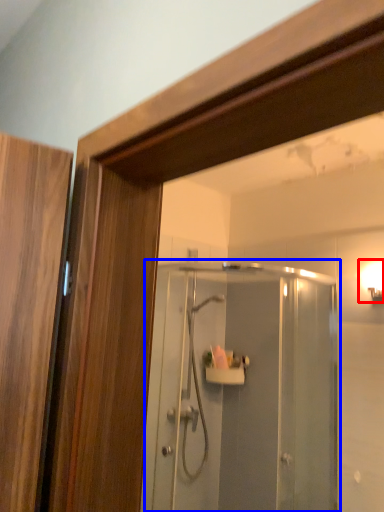
Question: Which of the following is the farthest to the observer, light fixture (highlighted by a red box) or screen door (highlighted by a blue box)?

Choices:
 (A) light fixture
 (B) screen door

Answer: (A)